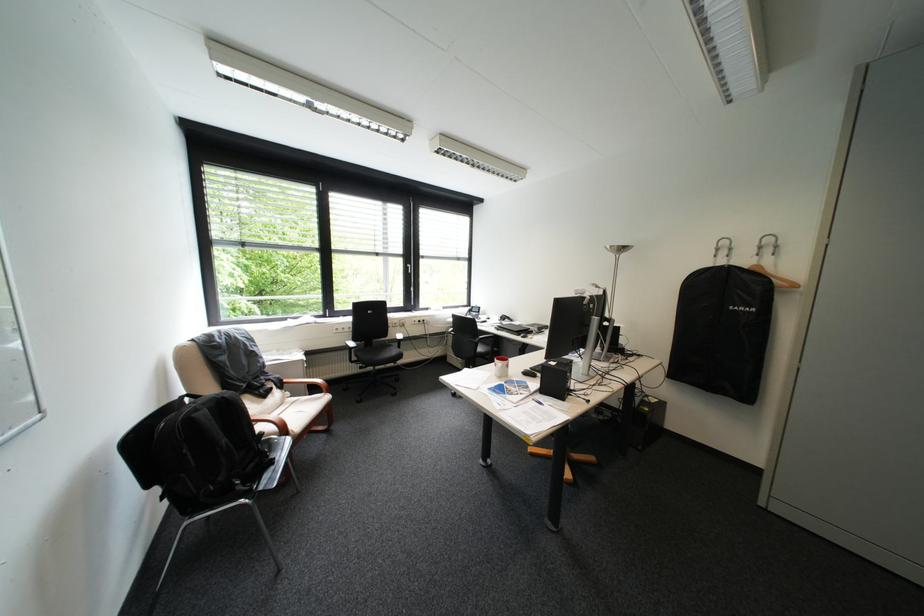
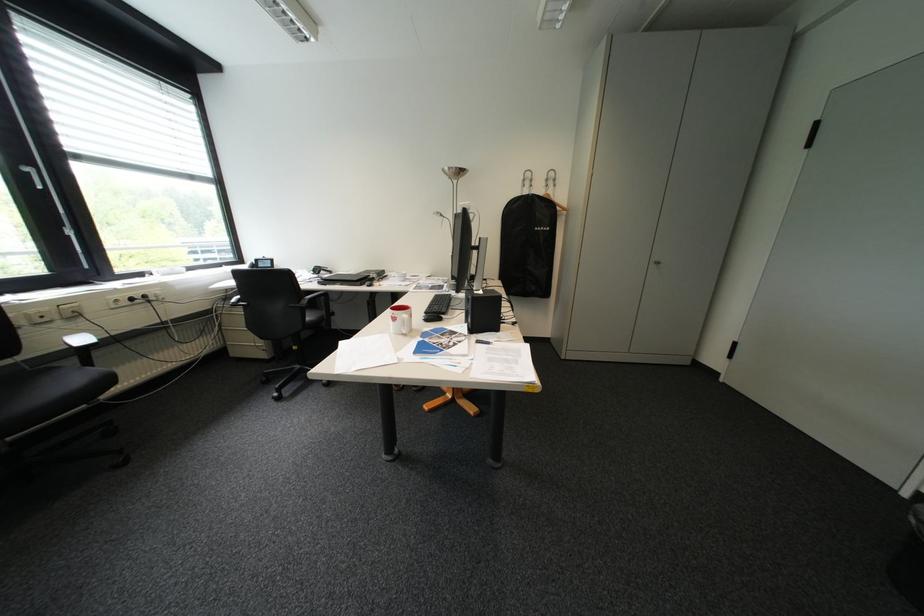
Find the pixel in the second image that matches (519,367) in the first image.

(423, 315)